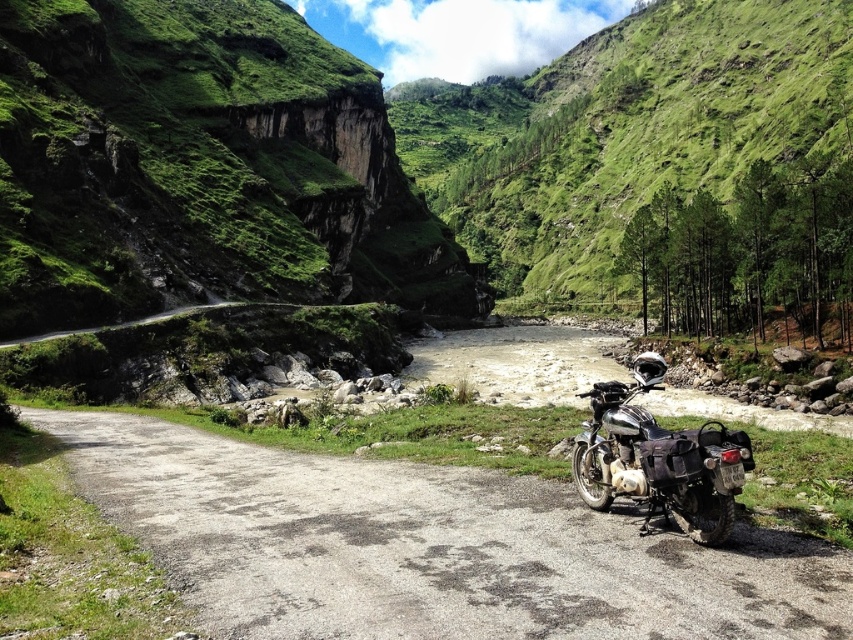
Question: Which of the following is the farthest from the observer?

Choices:
 (A) smooth asphalt road at center
 (B) shiny chrome motorcycle at center
 (C) green grassy hillside at center

Answer: (C)

Question: Does green grassy hillside at center appear over smooth asphalt road at center?

Choices:
 (A) no
 (B) yes

Answer: (B)

Question: Which of these objects is positioned closest to the shiny chrome motorcycle at center?

Choices:
 (A) green grassy hillside at center
 (B) smooth asphalt road at center

Answer: (B)

Question: Which of the following is the closest to the observer?

Choices:
 (A) shiny chrome motorcycle at center
 (B) smooth asphalt road at center

Answer: (B)

Question: Does smooth asphalt road at center have a greater width compared to shiny chrome motorcycle at center?

Choices:
 (A) no
 (B) yes

Answer: (B)

Question: Can you confirm if smooth asphalt road at center is positioned above shiny chrome motorcycle at center?

Choices:
 (A) no
 (B) yes

Answer: (A)